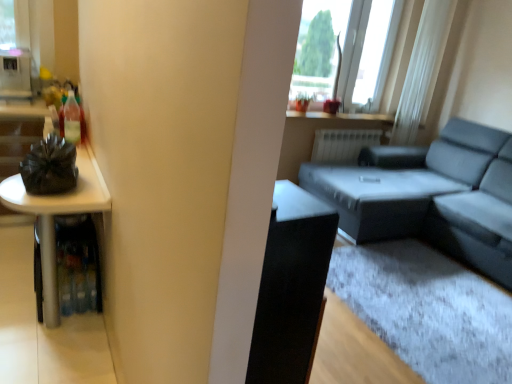
Question: In the image, is white glossy refrigerator at upper left positioned in front of or behind matte gray couch at right?

Choices:
 (A) behind
 (B) front

Answer: (A)

Question: From a real-world perspective, is white glossy refrigerator at upper left positioned above or below matte gray couch at right?

Choices:
 (A) below
 (B) above

Answer: (B)

Question: Estimate the real-world distances between objects in this image. Which object is farther from the white sheer curtain at upper right?

Choices:
 (A) matte gray couch at right
 (B) white glossy refrigerator at upper left
 (C) transparent glass window at upper right
 (D) white glossy table at left

Answer: (B)

Question: Which is farther from the white glossy table at left?

Choices:
 (A) white glossy refrigerator at upper left
 (B) white sheer curtain at upper right
 (C) matte gray couch at right
 (D) transparent glass window at upper right

Answer: (B)